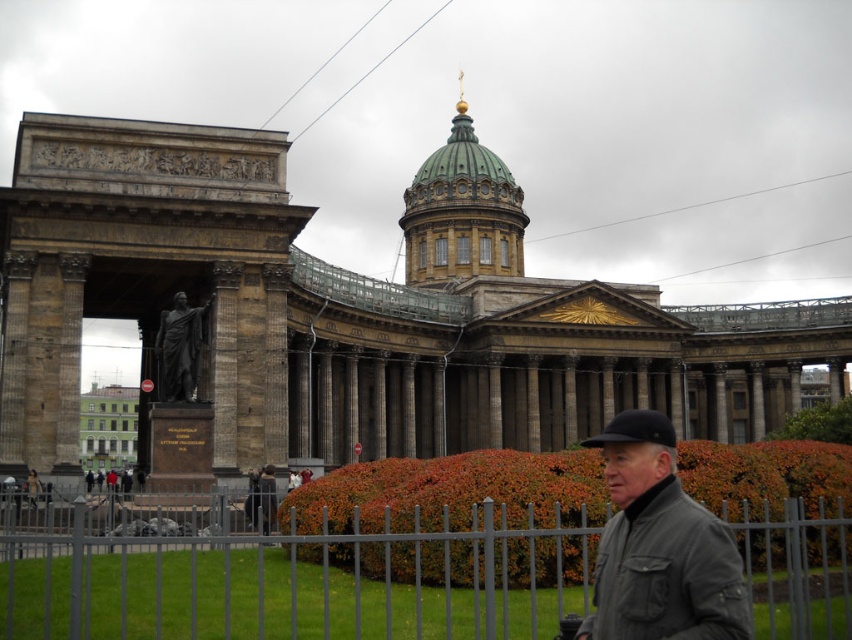
Is point (22, 172) farther from viewer compared to point (18, 534)?

Yes, it is behind point (18, 534).

Can you confirm if brown stone palace at center is taller than metallic gray fence at lower center?

Yes.

Between point (232, 436) and point (296, 547), which one is positioned behind?

The point (232, 436) is more distant.

This screenshot has height=640, width=852. Find the location of `brown stone palace at center`. brown stone palace at center is located at coordinates (354, 310).

Is brown stone palace at center bigger than polished bronze statue at center?

Correct, brown stone palace at center is larger in size than polished bronze statue at center.

The image size is (852, 640). Identify the location of brown stone palace at center. (354, 310).

Is brown stone palace at center further to the viewer compared to dark gray jacket at lower right?

Yes, brown stone palace at center is further from the viewer.

Where is `brown stone palace at center`? brown stone palace at center is located at coordinates (354, 310).

Is point (255, 204) farther from camera compared to point (682, 634)?

That is True.

Where is `brown stone palace at center`? brown stone palace at center is located at coordinates (354, 310).